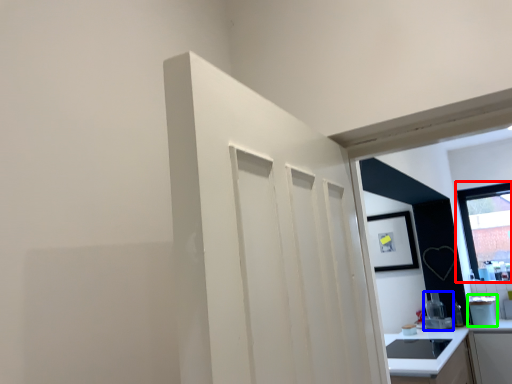
Question: Estimate the real-world distances between objects in this image. Which object is farther from window (highlighted by a red box), appliance (highlighted by a blue box) or appliance (highlighted by a green box)?

Choices:
 (A) appliance
 (B) appliance

Answer: (A)